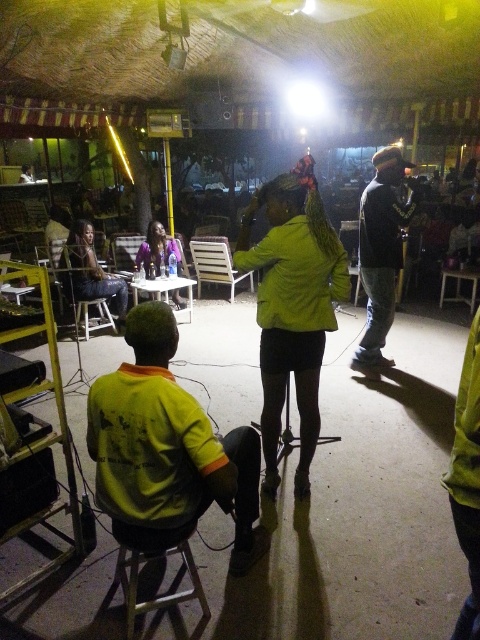
Between point (249, 454) and point (201, 605), which one is positioned behind?

The point (249, 454) is behind.

Does point (133, 438) come closer to viewer compared to point (126, 612)?

Yes, point (133, 438) is closer to viewer.

Identify the location of yellow fabric shirt at lower left. (168, 448).

Between point (143, 541) and point (386, 262), which one is positioned behind?

The point (386, 262) is behind.

Looking at this image, does yellow fabric shirt at lower left have a lesser height compared to black matte sweater at center?

Indeed, yellow fabric shirt at lower left has a lesser height compared to black matte sweater at center.

What do you see at coordinates (168, 448) in the screenshot? I see `yellow fabric shirt at lower left` at bounding box center [168, 448].

Locate an element on the screen. yellow fabric shirt at lower left is located at coordinates (168, 448).

Who is positioned more to the right, black matte sweater at center or matte purple jacket at center?

black matte sweater at center is more to the right.

Locate an element on the screen. black matte sweater at center is located at coordinates (382, 252).